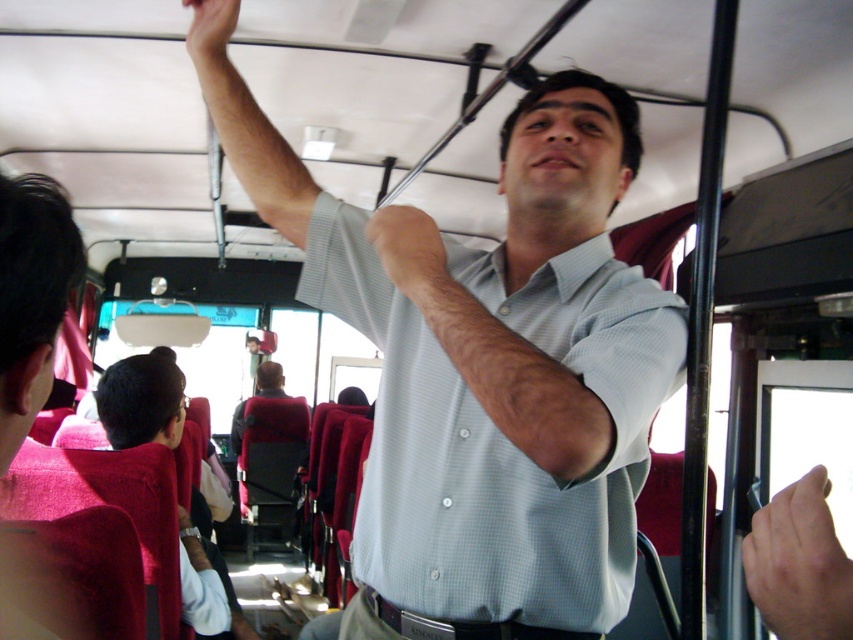
Question: Is light gray shirt at center wider than matte skin hand at upper center?

Choices:
 (A) no
 (B) yes

Answer: (B)

Question: Which object is closer to the camera taking this photo?

Choices:
 (A) light blue checkered shirt at upper center
 (B) smooth skin hand at upper right
 (C) light gray shirt at center

Answer: (B)

Question: Which of the following is the closest to the observer?

Choices:
 (A) (129, 392)
 (B) (439, 483)
 (C) (813, 596)

Answer: (C)

Question: Can you confirm if light blue checkered shirt at upper center is wider than light gray shirt at center?

Choices:
 (A) yes
 (B) no

Answer: (A)

Question: Which of the following is the farthest from the observer?

Choices:
 (A) (212, 593)
 (B) (776, 566)
 (C) (496, 593)
 (D) (418, 212)

Answer: (A)

Question: Can you confirm if smooth skin hand at upper right is smaller than matte skin hand at upper center?

Choices:
 (A) yes
 (B) no

Answer: (A)